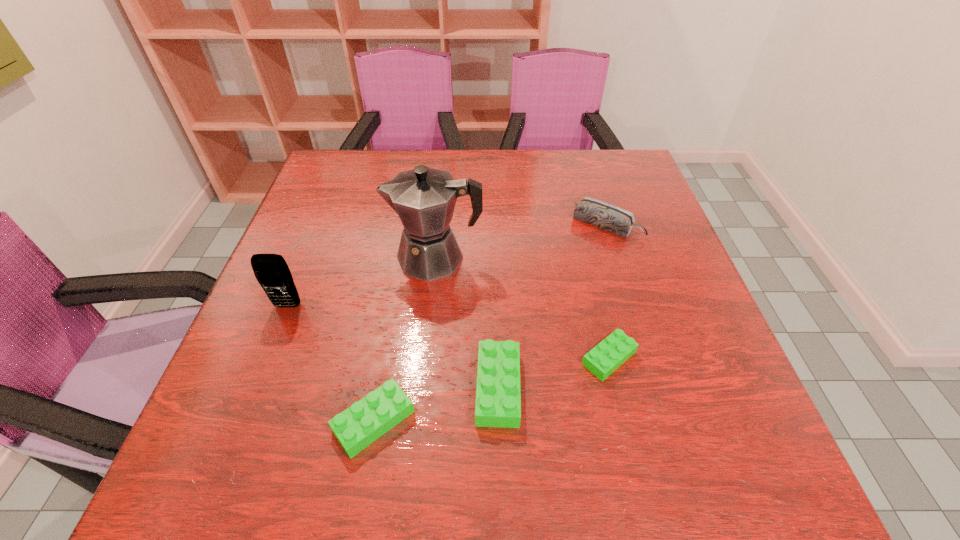
Find the location of a particular element. The height and width of the screenshot is (540, 960). the fifth tallest object is located at coordinates (358, 426).

Image resolution: width=960 pixels, height=540 pixels. What are the coordinates of `the leftmost Lego` in the screenshot? It's located at (358, 426).

Find the location of a particular element. the tallest Lego is located at coordinates (498, 399).

Locate an element on the screen. This screenshot has width=960, height=540. the shortest Lego is located at coordinates (614, 350).

Find the location of a particular element. The width and height of the screenshot is (960, 540). the rightmost Lego is located at coordinates (614, 350).

Find the location of a particular element. Image resolution: width=960 pixels, height=540 pixels. the leftmost object is located at coordinates (271, 270).

This screenshot has width=960, height=540. I want to click on the second tallest object, so click(271, 270).

Where is `coffeepot`? coffeepot is located at coordinates (424, 198).

Where is `pencil box`? The height and width of the screenshot is (540, 960). pencil box is located at coordinates (611, 218).

The image size is (960, 540). Identify the location of vacant space located on the back of the fifth tallest object. (388, 342).